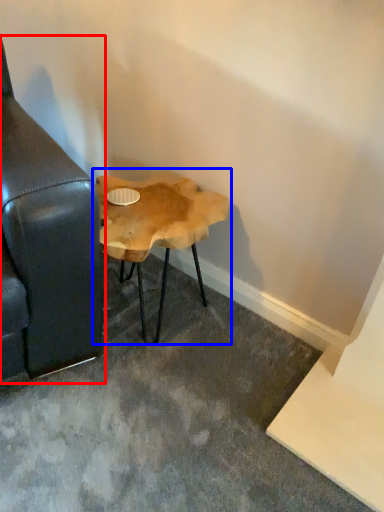
Question: Which of the following is the closest to the observer, studio couch (highlighted by a red box) or table (highlighted by a blue box)?

Choices:
 (A) studio couch
 (B) table

Answer: (A)